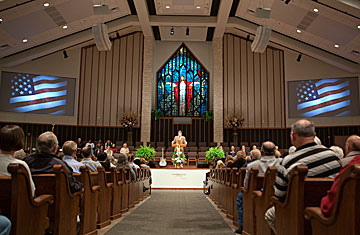
You are a GUI agent. You are given a task and a screenshot of the screen. Output one action in this format:
    pyautogui.click(x=<x>, y=<y>)
    Task: Click on the podium
    This screenshot has height=235, width=360.
    Given the screenshot: What is the action you would take?
    pyautogui.click(x=181, y=145)